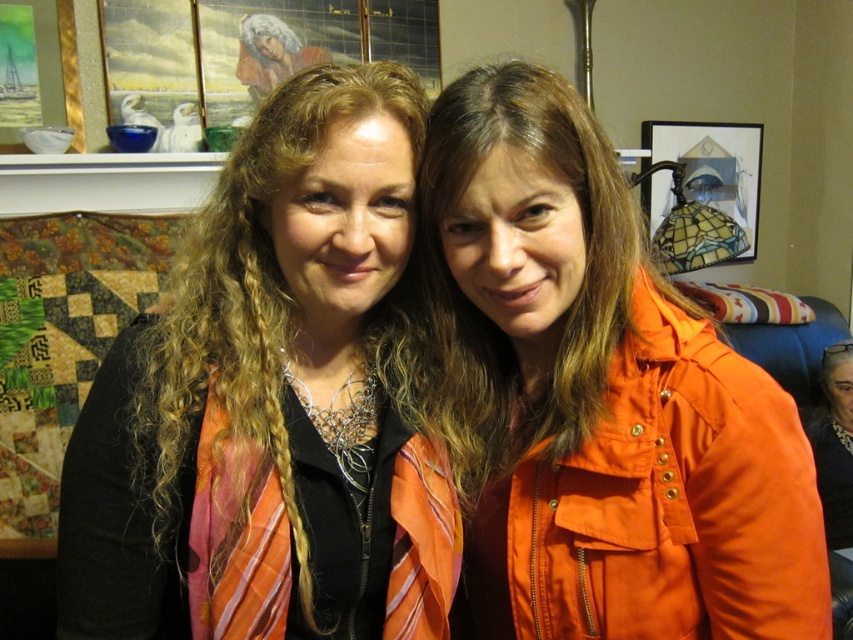
You are a photographer trying to capture a closeup of the orange fabric scarf at left. Based on the scene description, where should you position the camera relative to the subjects?

The orange fabric scarf at left is located at point (273, 403), so you should position the camera slightly to the right and lower to focus on the orange fabric scarf at left.

You are a photographer adjusting the lighting in this indoor scene. You notice the orange fabric scarf at left and the orange matte jacket at center. Which object should you adjust the light to highlight first if you want to ensure both are visible but focus on the one closer to the camera?

The orange fabric scarf at left should be highlighted first since it is in front of the orange matte jacket at center, making it closer to the camera.